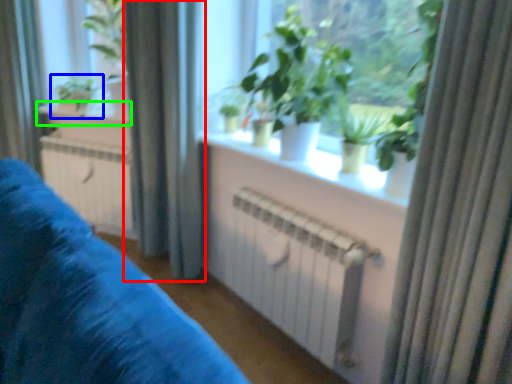
Question: Considering the real-world distances, which object is farthest from curtain (highlighted by a red box)? houseplant (highlighted by a blue box) or window sill (highlighted by a green box)?

Choices:
 (A) houseplant
 (B) window sill

Answer: (A)